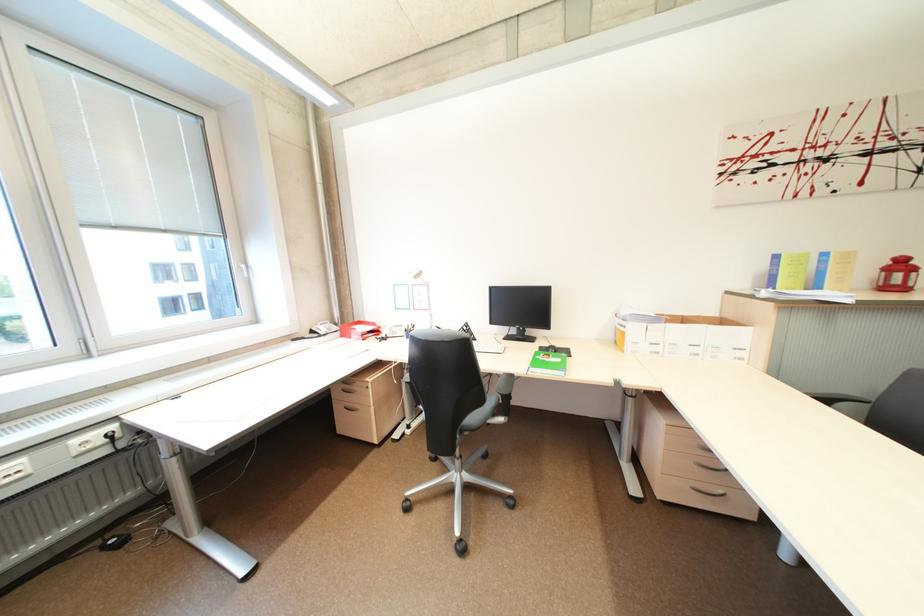
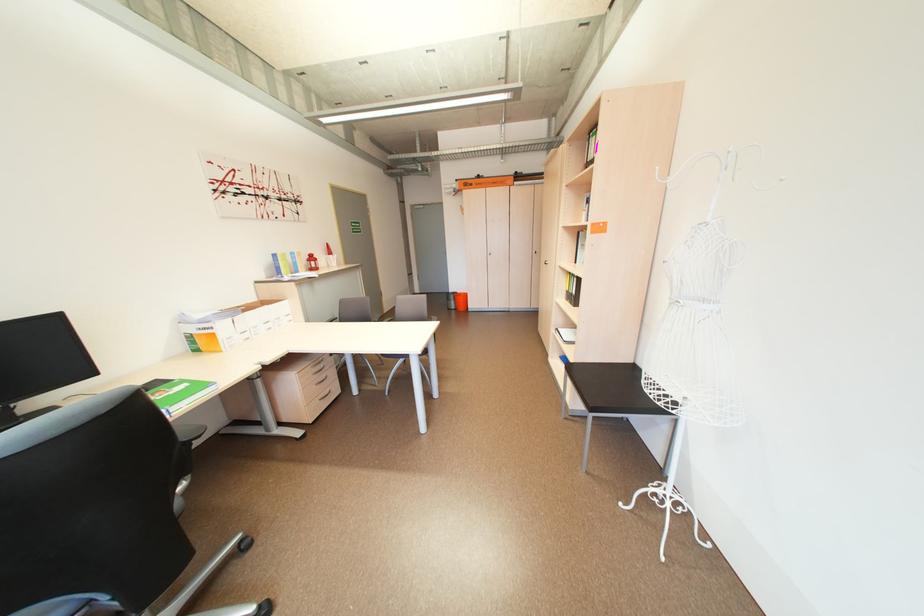
Question: I am providing you with two images of the same scene from different viewpoints. Please identify which objects are invisible in image2.

Choices:
 (A) small brown figurine
 (B) gray chair armrest
 (C) orange bucket
 (D) cabinet door handle

Answer: (B)